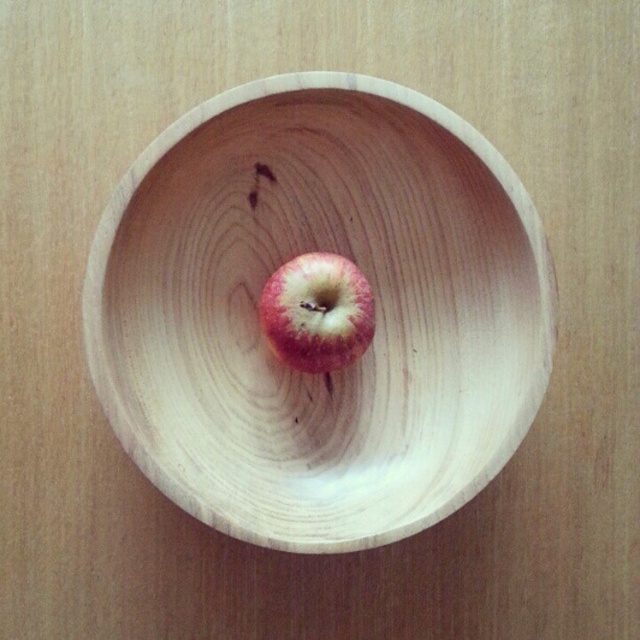
Can you confirm if natural wood bowl at center is shorter than red matte apple at center?

No, natural wood bowl at center is not shorter than red matte apple at center.

In the scene shown: Is natural wood bowl at center positioned at the back of red matte apple at center?

That is False.

Is point (298, 147) less distant than point (332, 300)?

No, (298, 147) is further to viewer.

The width and height of the screenshot is (640, 640). Find the location of `natural wood bowl at center`. natural wood bowl at center is located at coordinates (376, 314).